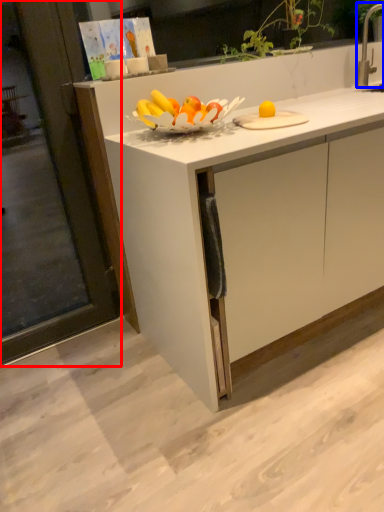
Question: Which of the following is the farthest to the observer, screen door (highlighted by a red box) or faucet (highlighted by a blue box)?

Choices:
 (A) screen door
 (B) faucet

Answer: (B)